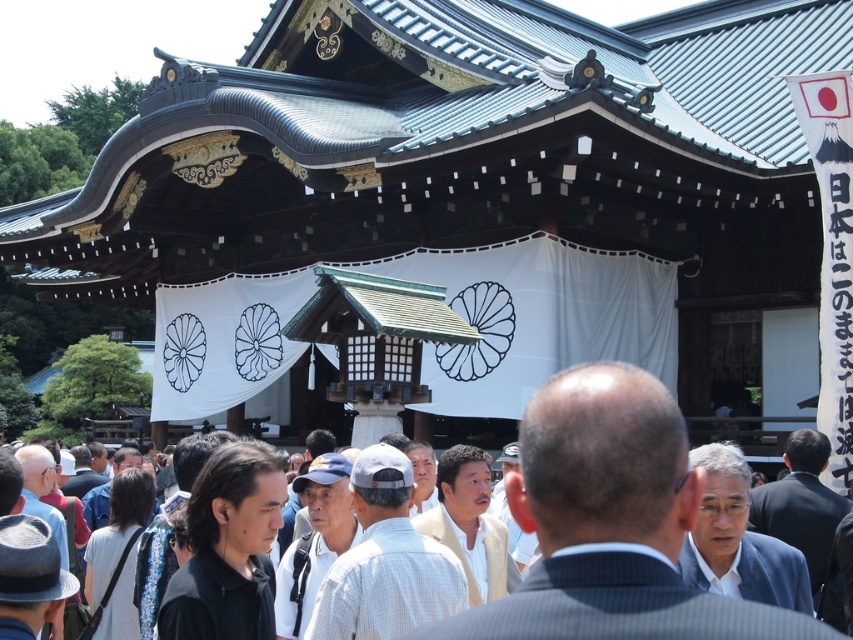
Question: Is black matte hair at center to the right of light gray fabric bag at lower left from the viewer's perspective?

Choices:
 (A) yes
 (B) no

Answer: (A)

Question: Does black matte hair at center appear on the right side of light gray fabric bag at lower left?

Choices:
 (A) no
 (B) yes

Answer: (B)

Question: Which object appears farthest from the camera in this image?

Choices:
 (A) light gray fabric bag at lower left
 (B) black matte hair at center

Answer: (A)

Question: Is the position of black matte hair at center less distant than that of light gray fabric bag at lower left?

Choices:
 (A) no
 (B) yes

Answer: (B)